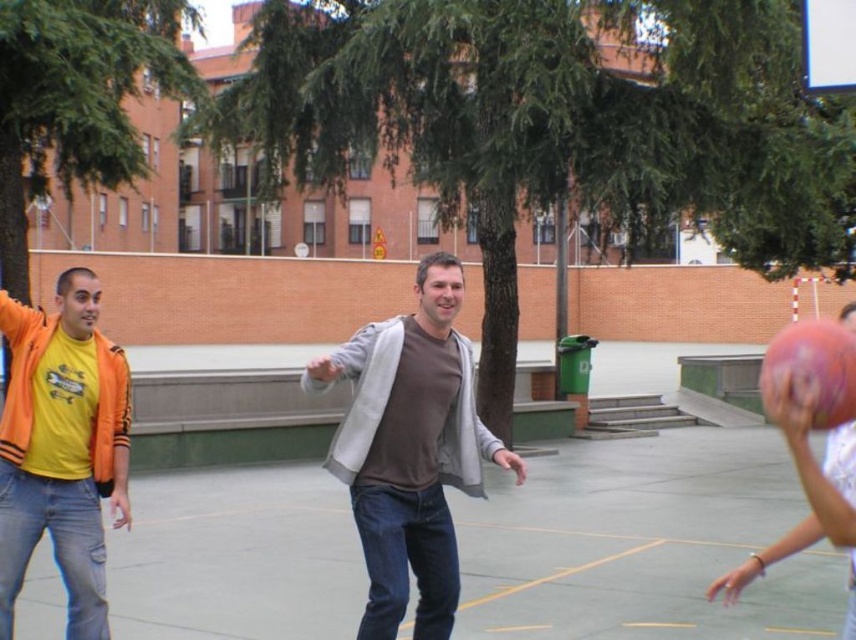
Question: Is rubber basketball at right further to the viewer compared to rubber textured basketball at right?

Choices:
 (A) no
 (B) yes

Answer: (B)

Question: Where is gray cotton sweater at center located in relation to rubber textured basketball at right in the image?

Choices:
 (A) left
 (B) right

Answer: (A)

Question: Based on their relative distances, which object is nearer to the rubber textured basketball at right?

Choices:
 (A) gray cotton sweater at center
 (B) matte orange jacket at left

Answer: (B)

Question: Which of the following is the closest to the observer?

Choices:
 (A) (800, 381)
 (B) (470, 480)
 (C) (849, 636)
 (D) (123, 522)

Answer: (A)

Question: Can you confirm if matte orange jacket at left is smaller than rubber basketball at right?

Choices:
 (A) no
 (B) yes

Answer: (A)

Question: Which point appears farthest from the camera in this image?

Choices:
 (A) (122, 502)
 (B) (389, 579)
 (C) (837, 412)
 (D) (759, 557)

Answer: (A)